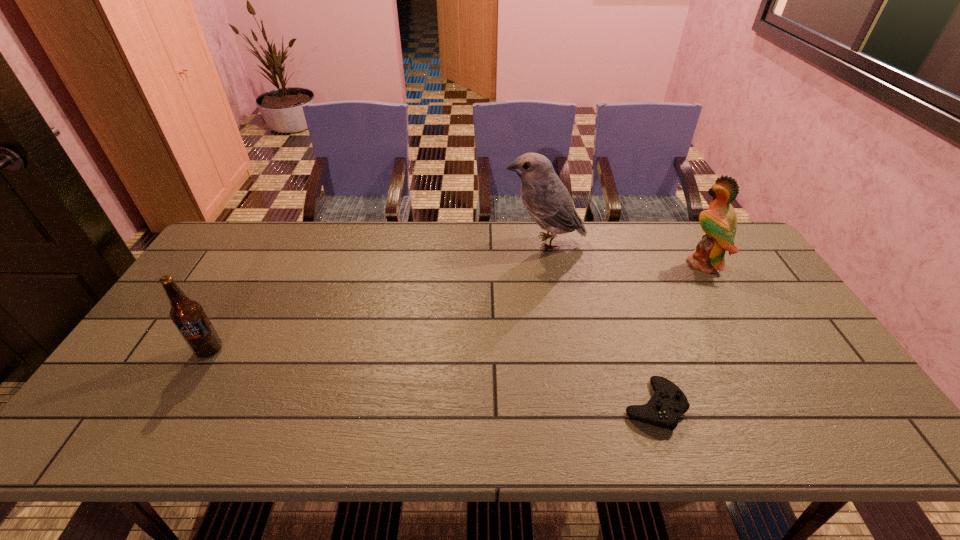
Find the location of a particular element. The image size is (960, 540). vacant area that lies between the control and the leftmost object is located at coordinates (431, 377).

Locate an element on the screen. free space that is in between the shortest object and the right parrot is located at coordinates (679, 334).

Where is `vacant space that is in between the right parrot and the beer bottle`? The width and height of the screenshot is (960, 540). vacant space that is in between the right parrot and the beer bottle is located at coordinates (456, 307).

Locate an element on the screen. free spot between the leftmost object and the right parrot is located at coordinates (456, 307).

In order to click on free space between the left parrot and the beer bottle in this screenshot , I will do tap(376, 296).

Locate an element on the screen. The height and width of the screenshot is (540, 960). object that ranks as the closest to the right parrot is located at coordinates (547, 200).

Find the location of a particular element. object that stands as the closest to the shortest object is located at coordinates (719, 222).

This screenshot has width=960, height=540. Identify the location of free spot that satisfies the following two spatial constraints: 1. on the front-facing side of the rightmost object; 2. on the label of the third tallest object. (754, 350).

This screenshot has height=540, width=960. I want to click on free space in the image that satisfies the following two spatial constraints: 1. on the front-facing side of the right parrot; 2. on the label of the beer bottle, so click(x=754, y=350).

The width and height of the screenshot is (960, 540). Find the location of `vacant space that satisfies the following two spatial constraints: 1. on the front-facing side of the right parrot; 2. on the label of the third tallest object`. vacant space that satisfies the following two spatial constraints: 1. on the front-facing side of the right parrot; 2. on the label of the third tallest object is located at coordinates (754, 350).